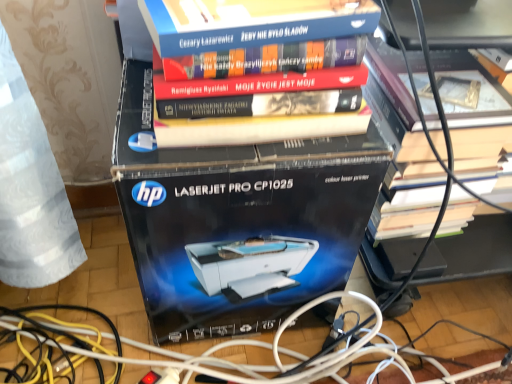
What are the coordinates of `hardcover book at center` in the screenshot? It's located at (237, 219).

This screenshot has width=512, height=384. What do you see at coordinates (237, 219) in the screenshot?
I see `hardcover book at center` at bounding box center [237, 219].

Identify the location of hardcover book at center. pyautogui.click(x=237, y=219).